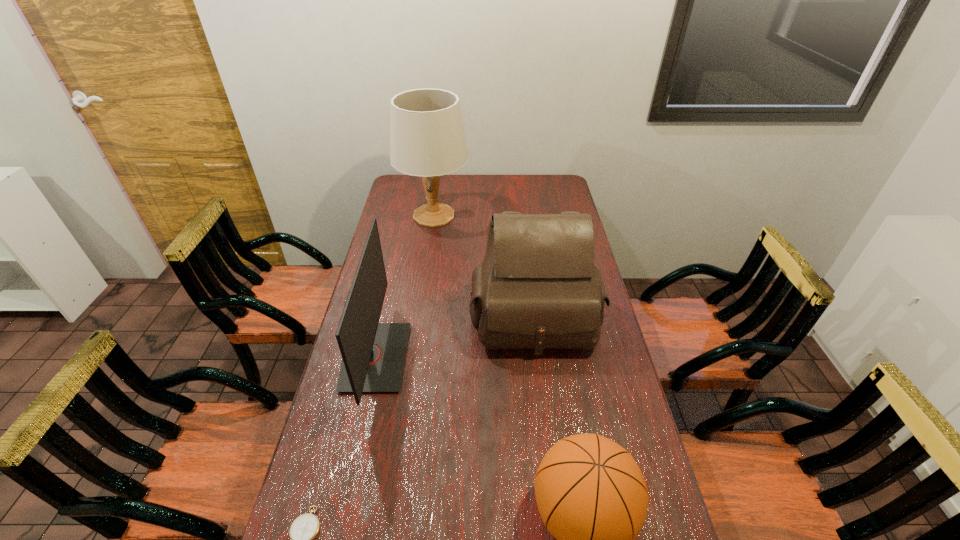
Find the location of `object present at the right edge`. object present at the right edge is located at coordinates (537, 287).

Where is `object positioned at the far left corner`? The width and height of the screenshot is (960, 540). object positioned at the far left corner is located at coordinates (x=427, y=138).

At what (x,y) coordinates should I click in order to perform the action: click on vacant region at the left edge of the desktop. Please return your answer as a coordinate pair (x, y). This screenshot has width=960, height=540. Looking at the image, I should click on (406, 219).

You are a GUI agent. You are given a task and a screenshot of the screen. Output one action in this format:
    pyautogui.click(x=<x>, y=<y>)
    Task: Click on the vacant region at the right edge of the desktop
    The height and width of the screenshot is (540, 960).
    Given the screenshot: What is the action you would take?
    pyautogui.click(x=552, y=199)

Where is `free space between the monitor and the tallest object`? free space between the monitor and the tallest object is located at coordinates (404, 286).

I want to click on empty space that is in between the monitor and the satchel, so click(454, 336).

The image size is (960, 540). In order to click on empty space between the satchel and the monitor in this screenshot , I will do `click(454, 336)`.

You are a GUI agent. You are given a task and a screenshot of the screen. Output one action in this format:
    pyautogui.click(x=<x>, y=<y>)
    Task: Click on the free spot between the satchel and the monitor
    This screenshot has width=960, height=540.
    Given the screenshot: What is the action you would take?
    pyautogui.click(x=454, y=336)

Identify which object is the closest to the monitor. Please provide its 2D coordinates. Your answer should be formatted as a tuple, i.e. [(x, y)], where the tuple contains the x and y coordinates of a point satisfying the conditions above.

[(537, 287)]

Point out which object is positioned as the second nearest to the satchel. Please provide its 2D coordinates. Your answer should be formatted as a tuple, i.e. [(x, y)], where the tuple contains the x and y coordinates of a point satisfying the conditions above.

[(427, 138)]